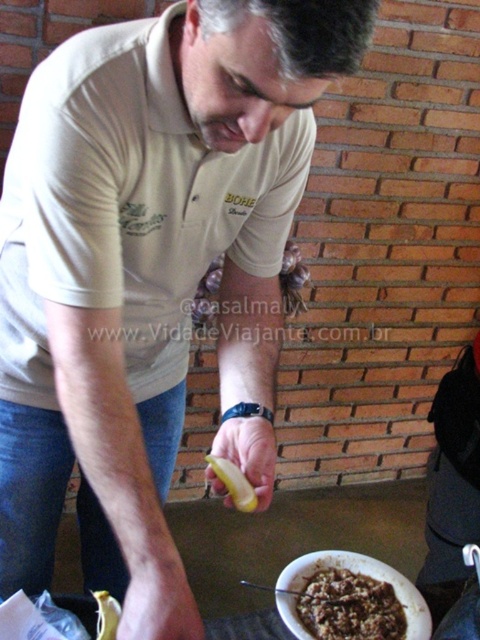
You are a food inspector checking the distance between the brown matte food at lower center and the yellow matte banana at center. According to regulations, the minimum required distance between any two food items on a serving tray must be at least 9 inches. Can you confirm if the current distance meets the requirement?

The brown matte food at lower center and yellow matte banana at center are 8.91 inches apart from each other, which is less than the required 9 inches. Therefore, the distance does not meet the regulation requirement.

You are a food critic standing in front of a dish that contains the brown matte food at lower center and the yellow matte banana at center. You need to describe the arrangement of these items to your colleague. Which item is located to the right of the other?

The brown matte food at lower center is positioned on the right side of yellow matte banana at center.